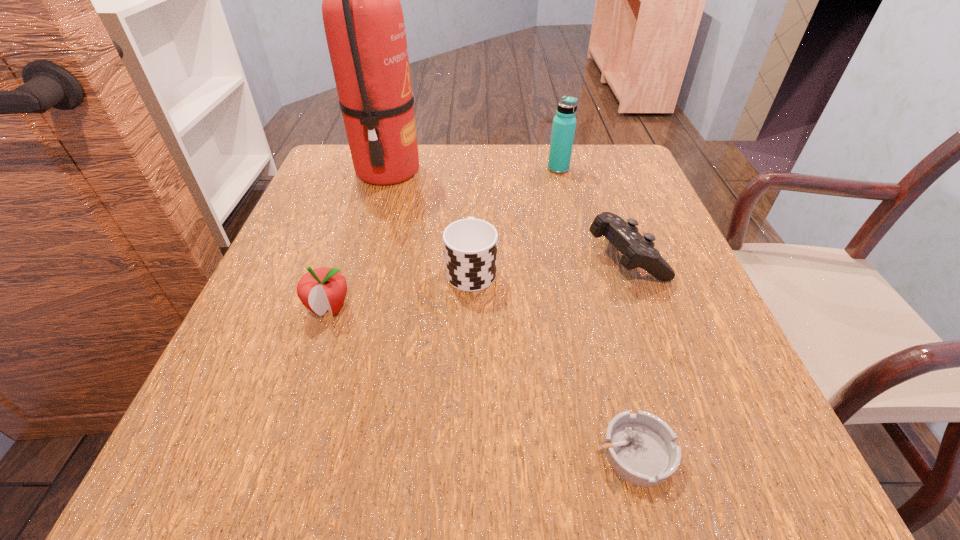
Where is `vacant region located on the side of the third object from left to right with the handle`? The height and width of the screenshot is (540, 960). vacant region located on the side of the third object from left to right with the handle is located at coordinates (473, 158).

At what (x,y) coordinates should I click in order to perform the action: click on blank area located 0.050m on the side of the third object from left to right with the handle. Please return your answer as a coordinate pair (x, y). Image resolution: width=960 pixels, height=540 pixels. Looking at the image, I should click on (472, 231).

Find the location of a particular element. The width and height of the screenshot is (960, 540). free space located 0.050m on the side of the third object from left to right with the handle is located at coordinates (472, 231).

At what (x,y) coordinates should I click in order to perform the action: click on free space located on the left of the second shortest object. Please return your answer as a coordinate pair (x, y). This screenshot has width=960, height=540. Looking at the image, I should click on (540, 257).

The image size is (960, 540). Find the location of `vacant area situated 0.180m on the left of the ashtray`. vacant area situated 0.180m on the left of the ashtray is located at coordinates (455, 452).

Where is `fire extinguisher located in the far edge section of the desktop`? Image resolution: width=960 pixels, height=540 pixels. fire extinguisher located in the far edge section of the desktop is located at coordinates (363, 19).

Identify the location of water bottle that is at the far edge. (563, 129).

Locate an element on the screen. object at the near edge is located at coordinates (641, 448).

Where is `fire extinguisher that is at the left edge`? Image resolution: width=960 pixels, height=540 pixels. fire extinguisher that is at the left edge is located at coordinates (363, 19).

You are a GUI agent. You are given a task and a screenshot of the screen. Output one action in this format:
    pyautogui.click(x=<x>, y=<y>)
    Task: Click on the apple present at the left edge
    
    Given the screenshot: What is the action you would take?
    pyautogui.click(x=321, y=289)